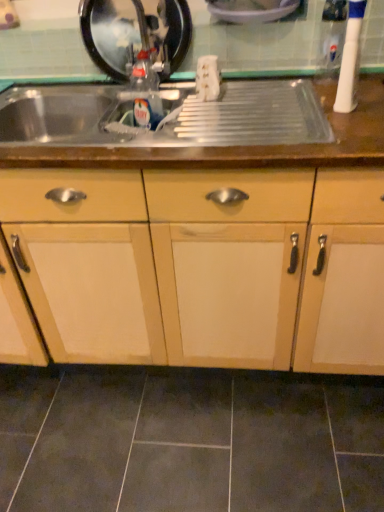
The width and height of the screenshot is (384, 512). Describe the element at coordinates (251, 260) in the screenshot. I see `wooden cabinet at center` at that location.

What is the approximate width of metallic stainless steel sink at upper center?

The width of metallic stainless steel sink at upper center is 22.01 inches.

The width and height of the screenshot is (384, 512). I want to click on white plastic bowl at upper center, which is the 2th appliance in right-to-left order, so click(x=251, y=10).

Identify the location of white plastic toothbrush at upper right, the 1th appliance viewed from the right. (350, 59).

Is wooden cabinet at center positioned with its back to metallic stainless steel sink at upper center?

Absolutely, wooden cabinet at center is directed away from metallic stainless steel sink at upper center.

From the image's perspective, which is below, wooden cabinet at center or metallic stainless steel sink at upper center?

wooden cabinet at center appears lower in the image.

Which object is more forward, wooden cabinet at center or metallic stainless steel sink at upper center?

wooden cabinet at center is in front.

What's the angular difference between wooden cabinet at center and metallic stainless steel sink at upper center's facing directions?

The angular difference between wooden cabinet at center and metallic stainless steel sink at upper center is 4.31e-05 degrees.

In the scene shown: Do you think wooden cabinet at center is within white plastic toothbrush at upper right, which is counted as the third appliance, starting from the left, or outside of it?

wooden cabinet at center is not enclosed by white plastic toothbrush at upper right, which is counted as the third appliance, starting from the left.

Does wooden cabinet at center turn towards white plastic toothbrush at upper right, which is counted as the third appliance, starting from the left?

No, wooden cabinet at center is not oriented towards white plastic toothbrush at upper right, which is counted as the third appliance, starting from the left.

Considering the relative sizes of wooden cabinet at center and white plastic toothbrush at upper right, which is counted as the third appliance, starting from the left, in the image provided, is wooden cabinet at center shorter than white plastic toothbrush at upper right, which is counted as the third appliance, starting from the left,?

No.

Looking at this image, how different are the orientations of wooden cabinet at center and white plastic toothbrush at upper right, which is counted as the third appliance, starting from the left, in degrees?

The angle between the facing direction of wooden cabinet at center and the facing direction of white plastic toothbrush at upper right, which is counted as the third appliance, starting from the left, is 0.000296 degrees.

From the image's perspective, is dark gray ceramic tile at lower center above or below white plastic bowl at upper center, the 2th appliance viewed from the left?

dark gray ceramic tile at lower center is below white plastic bowl at upper center, the 2th appliance viewed from the left.

Does dark gray ceramic tile at lower center appear on the left side of white plastic bowl at upper center, the 2th appliance viewed from the left?

Correct, you'll find dark gray ceramic tile at lower center to the left of white plastic bowl at upper center, the 2th appliance viewed from the left.

Does dark gray ceramic tile at lower center contain white plastic bowl at upper center, which is the 2th appliance in right-to-left order?

No, white plastic bowl at upper center, which is the 2th appliance in right-to-left order, is located outside of dark gray ceramic tile at lower center.

From a real-world perspective, is dark gray ceramic tile at lower center positioned above or below white plastic bowl at upper center, which is the 2th appliance in right-to-left order?

In terms of real-world spatial position, dark gray ceramic tile at lower center is below white plastic bowl at upper center, which is the 2th appliance in right-to-left order.

Based on the photo, is metallic black sink at upper left, placed as the 1th appliance when sorted from left to right, turned away from dark gray ceramic tile at lower center?

No, dark gray ceramic tile at lower center is not at the back of metallic black sink at upper left, placed as the 1th appliance when sorted from left to right.

Considering the positions of objects metallic black sink at upper left, placed as the 1th appliance when sorted from left to right, and dark gray ceramic tile at lower center in the image provided, who is more to the right, metallic black sink at upper left, placed as the 1th appliance when sorted from left to right, or dark gray ceramic tile at lower center?

Positioned to the right is dark gray ceramic tile at lower center.

Between metallic black sink at upper left, placed as the 1th appliance when sorted from left to right, and dark gray ceramic tile at lower center, which one has more height?

Standing taller between the two is metallic black sink at upper left, placed as the 1th appliance when sorted from left to right.

Is wooden cabinet at center shorter than white plastic bowl at upper center, which is the 2th appliance in right-to-left order?

In fact, wooden cabinet at center may be taller than white plastic bowl at upper center, which is the 2th appliance in right-to-left order.

Is white plastic bowl at upper center, the 2th appliance viewed from the left, at the back of wooden cabinet at center?

No, wooden cabinet at center's orientation is not away from white plastic bowl at upper center, the 2th appliance viewed from the left.

Between wooden cabinet at center and white plastic bowl at upper center, the 2th appliance viewed from the left, which one has larger width?

With larger width is wooden cabinet at center.

Considering the sizes of objects wooden cabinet at center and white plastic bowl at upper center, which is the 2th appliance in right-to-left order, in the image provided, who is smaller, wooden cabinet at center or white plastic bowl at upper center, which is the 2th appliance in right-to-left order,?

white plastic bowl at upper center, which is the 2th appliance in right-to-left order.

Choose the correct answer: Is metallic stainless steel sink at upper center inside dark gray ceramic tile at lower center or outside it?

metallic stainless steel sink at upper center cannot be found inside dark gray ceramic tile at lower center.

Is metallic stainless steel sink at upper center positioned with its back to dark gray ceramic tile at lower center?

metallic stainless steel sink at upper center does not have its back to dark gray ceramic tile at lower center.

Measure the distance from metallic stainless steel sink at upper center to dark gray ceramic tile at lower center.

metallic stainless steel sink at upper center is 34.15 inches from dark gray ceramic tile at lower center.

Does metallic stainless steel sink at upper center have a larger size compared to dark gray ceramic tile at lower center?

Yes.

Does dark gray ceramic tile at lower center turn towards wooden cabinet at center?

No, dark gray ceramic tile at lower center does not turn towards wooden cabinet at center.

Considering the relative sizes of dark gray ceramic tile at lower center and wooden cabinet at center in the image provided, is dark gray ceramic tile at lower center smaller than wooden cabinet at center?

Correct, dark gray ceramic tile at lower center occupies less space than wooden cabinet at center.

Is dark gray ceramic tile at lower center at the left side of wooden cabinet at center?

Incorrect, dark gray ceramic tile at lower center is not on the left side of wooden cabinet at center.

Considering the sizes of dark gray ceramic tile at lower center and wooden cabinet at center in the image, is dark gray ceramic tile at lower center wider or thinner than wooden cabinet at center?

Considering their sizes, dark gray ceramic tile at lower center looks broader than wooden cabinet at center.

Locate an element on the screen. This screenshot has width=384, height=512. cabinetry that appears below the metallic stainless steel sink at upper center (from a real-world perspective) is located at coordinates (251, 260).

Locate an element on the screen. the 2nd appliance to the right of the wooden cabinet at center, starting your count from the anchor is located at coordinates (350, 59).

Which object lies nearer to the anchor point metallic black sink at upper left, marked as the 3th appliance in a right-to-left arrangement, metallic stainless steel sink at upper center or white plastic toothbrush at upper right, which is counted as the third appliance, starting from the left?

metallic stainless steel sink at upper center lies closer to metallic black sink at upper left, marked as the 3th appliance in a right-to-left arrangement, than the other object.

Looking at the image, which one is located closer to wooden cabinet at center, white plastic bowl at upper center, the 2th appliance viewed from the left, or white plastic toothbrush at upper right, which is counted as the third appliance, starting from the left?

white plastic toothbrush at upper right, which is counted as the third appliance, starting from the left, is closer to wooden cabinet at center.

Estimate the real-world distances between objects in this image. Which object is further from metallic stainless steel sink at upper center, white plastic toothbrush at upper right, which is counted as the third appliance, starting from the left, or white plastic bowl at upper center, which is the 2th appliance in right-to-left order?

white plastic bowl at upper center, which is the 2th appliance in right-to-left order, is further to metallic stainless steel sink at upper center.

Which object lies further to the anchor point white plastic bowl at upper center, which is the 2th appliance in right-to-left order, white plastic toothbrush at upper right, which is counted as the third appliance, starting from the left, or metallic stainless steel sink at upper center?

metallic stainless steel sink at upper center is positioned further to the anchor white plastic bowl at upper center, which is the 2th appliance in right-to-left order.

Consider the image. Considering their positions, is metallic stainless steel sink at upper center positioned further to wooden cabinet at center than white plastic toothbrush at upper right, which is counted as the third appliance, starting from the left?

white plastic toothbrush at upper right, which is counted as the third appliance, starting from the left, lies further to wooden cabinet at center than the other object.

Considering their positions, is wooden cabinet at center positioned closer to metallic stainless steel sink at upper center than white plastic toothbrush at upper right, the 1th appliance viewed from the right?

The object closer to metallic stainless steel sink at upper center is white plastic toothbrush at upper right, the 1th appliance viewed from the right.

When comparing their distances from metallic black sink at upper left, marked as the 3th appliance in a right-to-left arrangement, does wooden cabinet at center or white plastic bowl at upper center, which is the 2th appliance in right-to-left order, seem further?

wooden cabinet at center is further to metallic black sink at upper left, marked as the 3th appliance in a right-to-left arrangement.

Looking at the image, which one is located closer to dark gray ceramic tile at lower center, metallic stainless steel sink at upper center or white plastic bowl at upper center, the 2th appliance viewed from the left?

The object closer to dark gray ceramic tile at lower center is metallic stainless steel sink at upper center.

Find the location of `cabinetry that lies between white plastic toothbrush at upper right, which is counted as the third appliance, starting from the left, and dark gray ceramic tile at lower center from top to bottom`. cabinetry that lies between white plastic toothbrush at upper right, which is counted as the third appliance, starting from the left, and dark gray ceramic tile at lower center from top to bottom is located at coordinates (251, 260).

Identify the location of appliance between metallic black sink at upper left, marked as the 3th appliance in a right-to-left arrangement, and white plastic toothbrush at upper right, which is counted as the third appliance, starting from the left, in the horizontal direction. (251, 10).

This screenshot has height=512, width=384. Find the location of `countertop that lies between metallic black sink at upper left, placed as the 1th appliance when sorted from left to right, and wooden cabinet at center from top to bottom`. countertop that lies between metallic black sink at upper left, placed as the 1th appliance when sorted from left to right, and wooden cabinet at center from top to bottom is located at coordinates (186, 147).

Where is `appliance between metallic black sink at upper left, marked as the 3th appliance in a right-to-left arrangement, and dark gray ceramic tile at lower center from top to bottom`? This screenshot has width=384, height=512. appliance between metallic black sink at upper left, marked as the 3th appliance in a right-to-left arrangement, and dark gray ceramic tile at lower center from top to bottom is located at coordinates (350, 59).